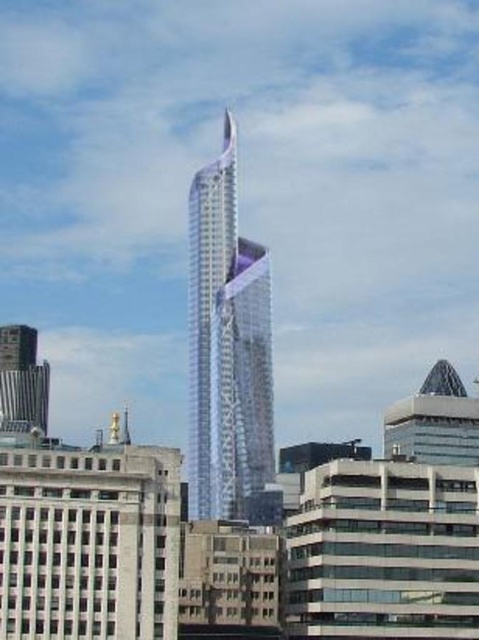
Which is in front, point (208, 323) or point (44, 384)?

Point (44, 384)

Who is lower down, sleek glass tower at center or metallic silver tower at lower left?

metallic silver tower at lower left is below.

You are a GUI agent. You are given a task and a screenshot of the screen. Output one action in this format:
    pyautogui.click(x=<x>, y=<y>)
    Task: Click on the sleek glass tower at center
    The height and width of the screenshot is (640, 479).
    Given the screenshot: What is the action you would take?
    pyautogui.click(x=227, y=348)

Identify the location of sleek glass tower at center. (227, 348).